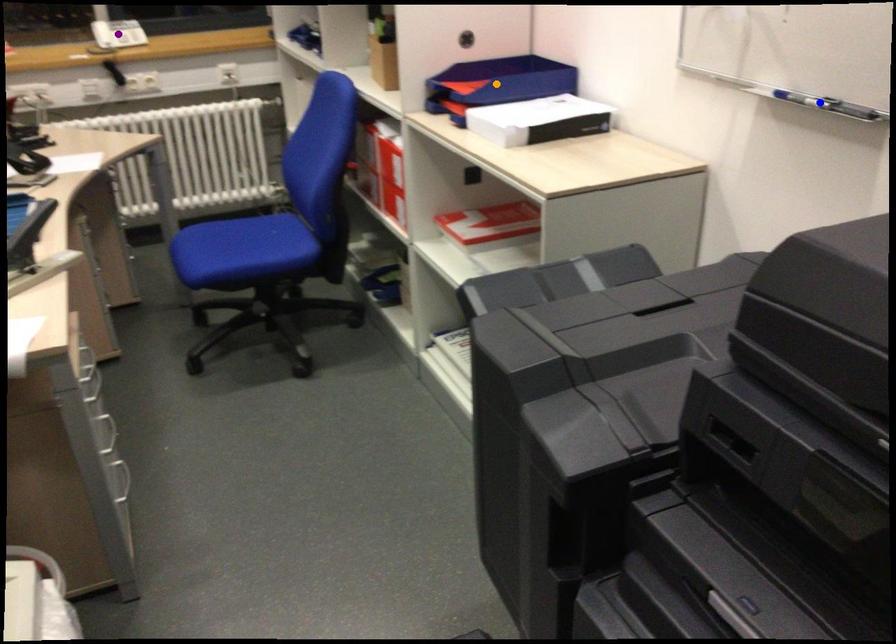
Order these from nearest to farthest:
blue point
purple point
orange point

blue point, orange point, purple point